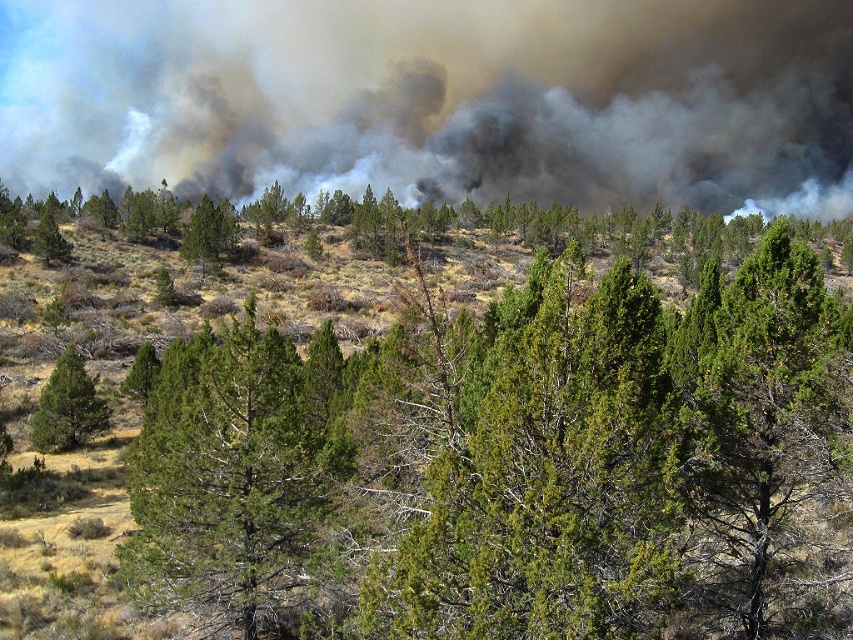
Looking at this image, is green textured tree at center closer to the viewer compared to green textured tree at left?

Yes, green textured tree at center is closer to the viewer.

Can you confirm if green textured tree at center is shorter than green textured tree at left?

No.

Between point (335, 346) and point (65, 378), which one is positioned behind?

The point (335, 346) is behind.

Image resolution: width=853 pixels, height=640 pixels. I want to click on green textured tree at center, so click(x=519, y=449).

Based on the photo, who is higher up, green textured tree at center or green needle-like tree at center?

Positioned higher is green textured tree at center.

Who is positioned more to the left, green textured tree at center or green needle-like tree at center?

Positioned to the left is green needle-like tree at center.

Does point (544, 616) come closer to viewer compared to point (305, 573)?

That is True.

I want to click on green textured tree at center, so click(519, 449).

Between green needle-like tree at center and green textured tree at left, which one appears on the left side from the viewer's perspective?

green textured tree at left is more to the left.

Is green needle-like tree at center behind green textured tree at left?

No, green needle-like tree at center is closer to the viewer.

The width and height of the screenshot is (853, 640). What are the coordinates of `green needle-like tree at center` in the screenshot? It's located at (234, 476).

At what (x,y) coordinates should I click in order to perform the action: click on green needle-like tree at center. Please return your answer as a coordinate pair (x, y). Image resolution: width=853 pixels, height=640 pixels. Looking at the image, I should click on (234, 476).